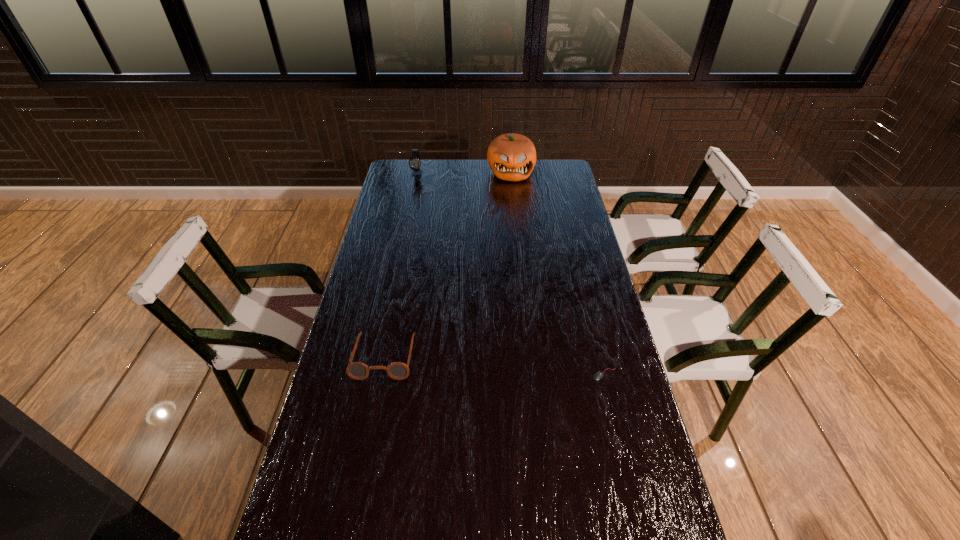
Where is `pumpkin positioned at the far edge`? pumpkin positioned at the far edge is located at coordinates (511, 157).

Find the location of a particular element. This screenshot has width=960, height=540. watch that is at the far edge is located at coordinates (414, 162).

Find the location of a particular element. watch that is at the left edge is located at coordinates (414, 162).

In order to click on spectacles positioned at the left edge in this screenshot , I will do `click(356, 370)`.

Where is `object present at the right edge`? This screenshot has width=960, height=540. object present at the right edge is located at coordinates (598, 375).

At what (x,y) coordinates should I click in order to perform the action: click on object that is at the far left corner. Please return your answer as a coordinate pair (x, y). This screenshot has height=540, width=960. Looking at the image, I should click on (414, 162).

Locate an element on the screen. The height and width of the screenshot is (540, 960). vacant space at the far edge of the desktop is located at coordinates (473, 168).

You are a GUI agent. You are given a task and a screenshot of the screen. Output one action in this format:
    pyautogui.click(x=<x>, y=<y>)
    Task: Click on the free location at the left edge
    The height and width of the screenshot is (540, 960).
    Given the screenshot: What is the action you would take?
    tap(369, 392)

In the image, there is a desktop. Where is `free space at the right edge`? Image resolution: width=960 pixels, height=540 pixels. free space at the right edge is located at coordinates (562, 303).

This screenshot has height=540, width=960. In the image, there is a desktop. What are the coordinates of `vacant space at the far right corner` in the screenshot? It's located at click(553, 178).